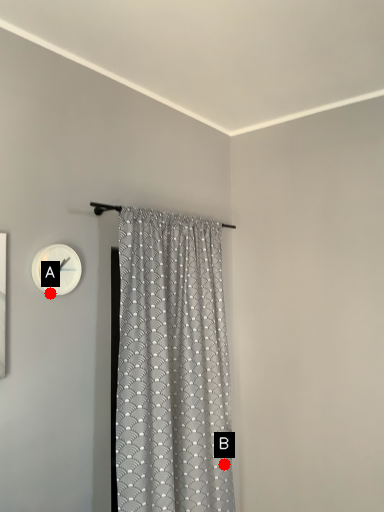
Question: Two points are circled on the image, labeled by A and B beside each circle. Among these points, which one is farthest from the camera?

Choices:
 (A) A is further
 (B) B is further

Answer: (B)